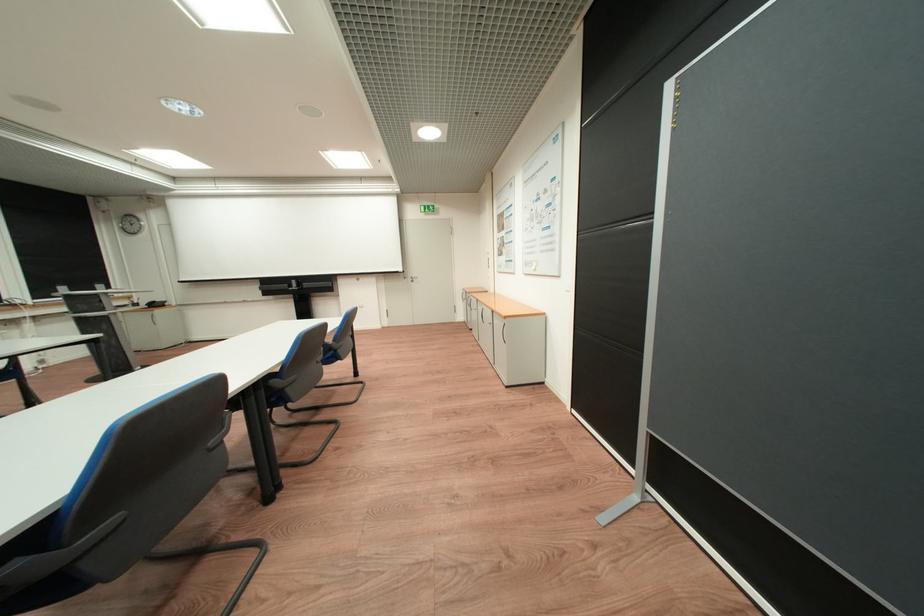
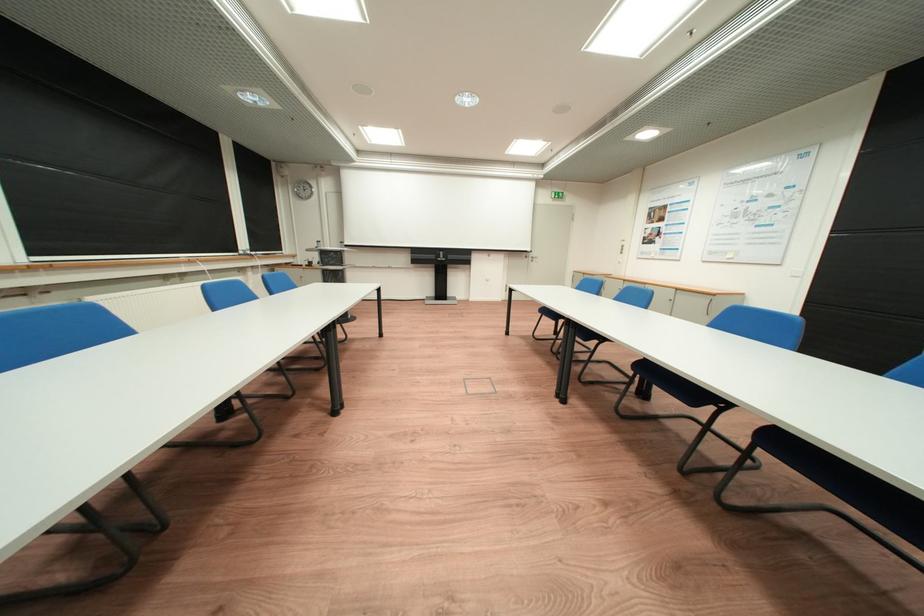
Question: What movement of the cameraman would produce the second image?

Choices:
 (A) Left
 (B) Right
 (C) Forward
 (D) Backward

Answer: (A)